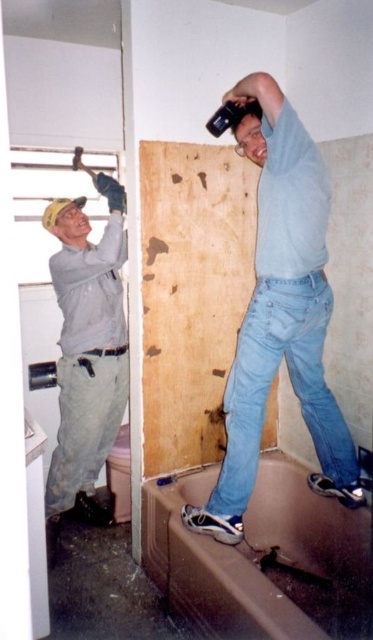
Question: Which point is closer to the camera taking this photo?

Choices:
 (A) (284, 212)
 (B) (73, 234)

Answer: (A)

Question: Which of the following is the closest to the observer?

Choices:
 (A) (79, 403)
 (B) (274, 340)

Answer: (B)

Question: Can you confirm if light blue denim jeans at upper right is positioned to the left of matte gray shirt at upper left?

Choices:
 (A) no
 (B) yes

Answer: (A)

Question: Is light blue denim jeans at upper right positioned before matte gray shirt at upper left?

Choices:
 (A) no
 (B) yes

Answer: (B)

Question: Does light blue denim jeans at upper right appear on the right side of matte gray shirt at upper left?

Choices:
 (A) yes
 (B) no

Answer: (A)